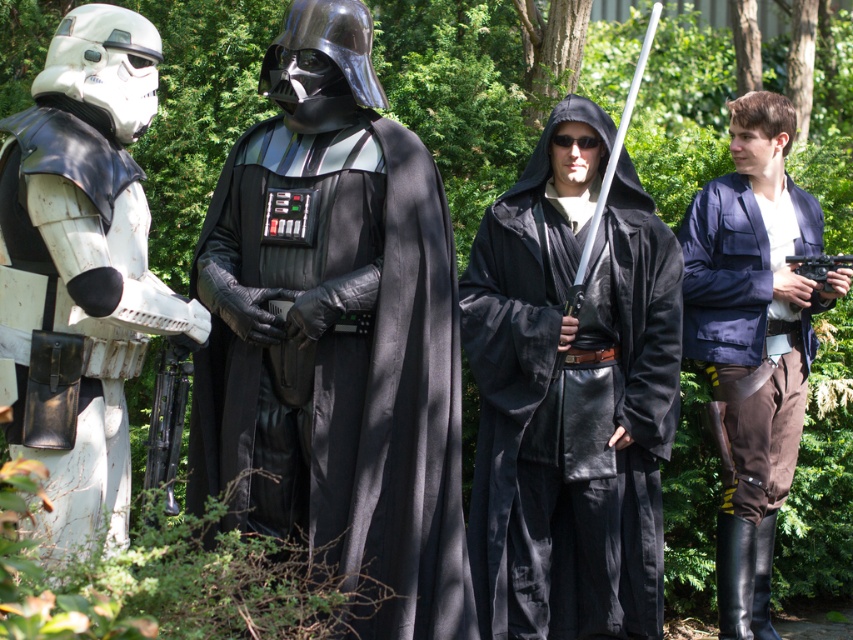
Question: Can you confirm if black leather cape at center is thinner than black linen robe at center?

Choices:
 (A) no
 (B) yes

Answer: (A)

Question: Which object is closer to the camera taking this photo?

Choices:
 (A) black leather cape at center
 (B) white matte armor at left

Answer: (B)

Question: Is black linen robe at center to the right of white matte armor at left from the viewer's perspective?

Choices:
 (A) yes
 (B) no

Answer: (A)

Question: Does black leather cape at center lie in front of navy blue fabric jacket at right?

Choices:
 (A) no
 (B) yes

Answer: (B)

Question: Which is farther from the navy blue fabric jacket at right?

Choices:
 (A) black leather cape at center
 (B) black linen robe at center
 (C) white matte armor at left

Answer: (C)

Question: Considering the real-world distances, which object is closest to the white matte armor at left?

Choices:
 (A) navy blue fabric jacket at right
 (B) black leather cape at center
 (C) black linen robe at center

Answer: (B)